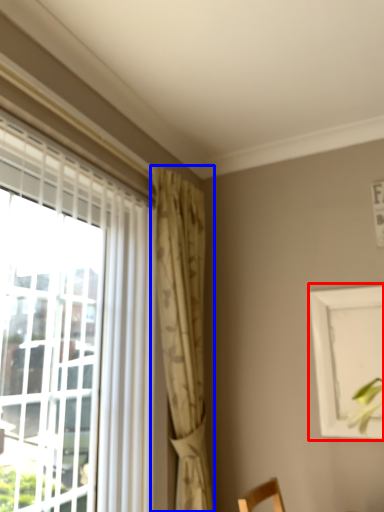
Question: Which object appears farthest to the camera in this image, picture frame (highlighted by a red box) or curtain (highlighted by a blue box)?

Choices:
 (A) picture frame
 (B) curtain

Answer: (A)